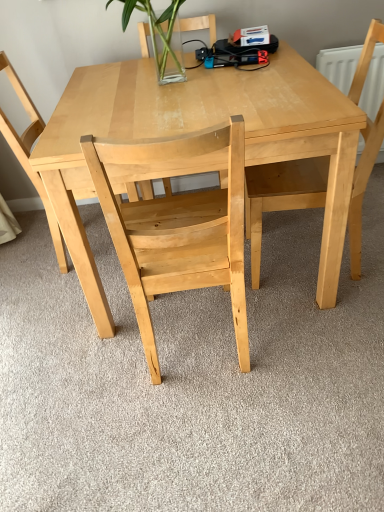
You are a GUI agent. You are given a task and a screenshot of the screen. Output one action in this format:
    pyautogui.click(x=<x>, y=<y>)
    Task: Click on the vacant area that is in front of natural wood table at center
    The width and height of the screenshot is (384, 512).
    Given the screenshot: What is the action you would take?
    pyautogui.click(x=201, y=414)